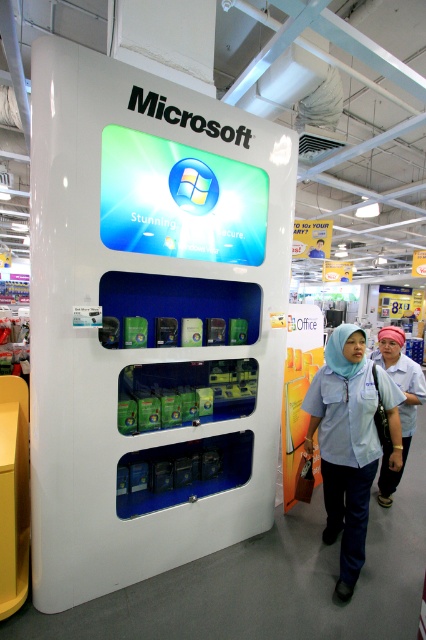
Between white plastic vending machine at center and white fabric hijab at center, which one is positioned higher?

white plastic vending machine at center

Does point (229, 516) lie behind point (397, 474)?

No, (229, 516) is in front of (397, 474).

At what (x,y) coordinates should I click in order to perform the action: click on white plastic vending machine at center. Please return your answer as a coordinate pair (x, y). This screenshot has width=426, height=640. Looking at the image, I should click on (149, 323).

What do you see at coordinates (345, 444) in the screenshot?
I see `light blue fabric shirt at center` at bounding box center [345, 444].

Between light blue fabric shirt at center and white fabric hijab at center, which one appears on the left side from the viewer's perspective?

light blue fabric shirt at center

Describe the element at coordinates (345, 444) in the screenshot. This screenshot has width=426, height=640. I see `light blue fabric shirt at center` at that location.

The image size is (426, 640). I want to click on light blue fabric shirt at center, so click(x=345, y=444).

Which is more to the right, white plastic vending machine at center or light blue fabric shirt at center?

light blue fabric shirt at center

Does white plastic vending machine at center appear on the left side of light blue fabric shirt at center?

Indeed, white plastic vending machine at center is positioned on the left side of light blue fabric shirt at center.

The image size is (426, 640). What do you see at coordinates (149, 323) in the screenshot?
I see `white plastic vending machine at center` at bounding box center [149, 323].

Where is `white plastic vending machine at center`? The image size is (426, 640). white plastic vending machine at center is located at coordinates (149, 323).